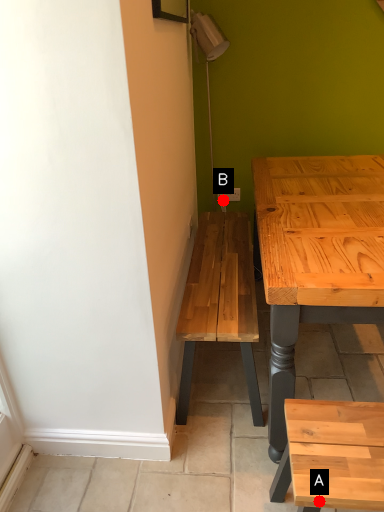
Question: Two points are circled on the image, labeled by A and B beside each circle. Which point is closer to the camera?

Choices:
 (A) A is closer
 (B) B is closer

Answer: (A)